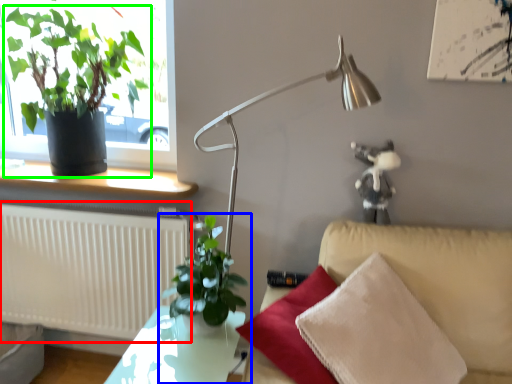
Question: Which is farther away from radiator (highlighted by a red box)? houseplant (highlighted by a blue box) or houseplant (highlighted by a green box)?

Choices:
 (A) houseplant
 (B) houseplant

Answer: (A)